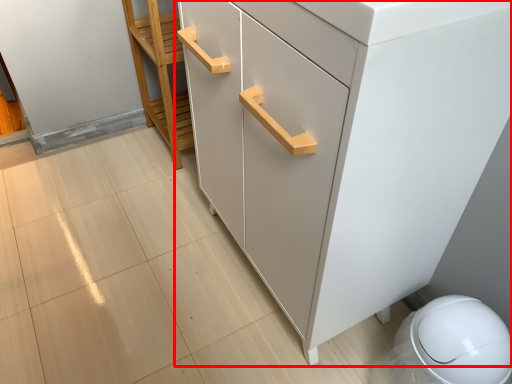
Question: Considering the relative positions of chest of drawers (annotated by the red box) and furniture in the image provided, where is chest of drawers (annotated by the red box) located with respect to the staircase?

Choices:
 (A) left
 (B) right

Answer: (B)